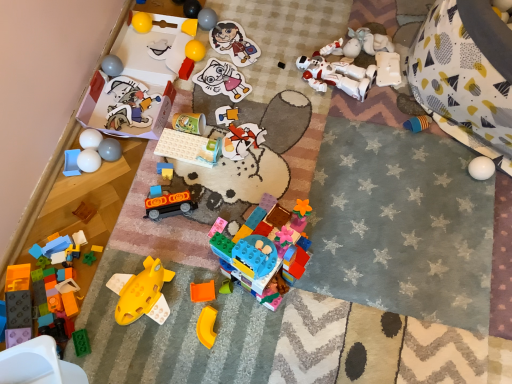
Identify the location of free space to the left of matte paper sticker at center, the eighteenth toy positioned from the left. (182, 92).